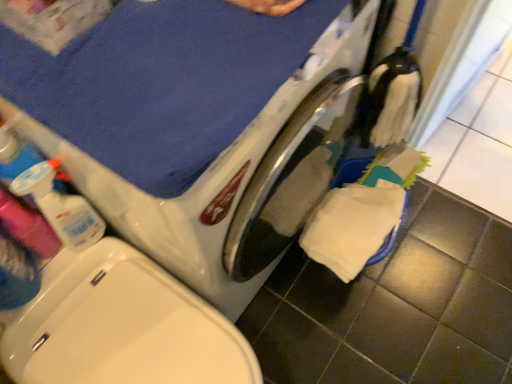
Where is `polished stainless steel washing machine at center`? polished stainless steel washing machine at center is located at coordinates (197, 126).

Measure the distance between polished stainless steel washing machine at center and camera.

polished stainless steel washing machine at center is 20.13 inches away from camera.

This screenshot has width=512, height=384. What do you see at coordinates (197, 126) in the screenshot?
I see `polished stainless steel washing machine at center` at bounding box center [197, 126].

Image resolution: width=512 pixels, height=384 pixels. What do you see at coordinates (60, 207) in the screenshot?
I see `translucent plastic spray bottle at left` at bounding box center [60, 207].

Identify the location of translucent plastic spray bottle at left. The height and width of the screenshot is (384, 512). (60, 207).

Locate an element on the screen. The width and height of the screenshot is (512, 384). polished stainless steel washing machine at center is located at coordinates (197, 126).

Is translucent plastic spray bottle at left to the left of polished stainless steel washing machine at center from the viewer's perspective?

Yes.

Between translucent plastic spray bottle at left and polished stainless steel washing machine at center, which one is positioned behind?

translucent plastic spray bottle at left is more distant.

Does point (59, 215) come closer to viewer compared to point (274, 255)?

Yes.

From the picture: From the image's perspective, between translucent plastic spray bottle at left and polished stainless steel washing machine at center, which one is located above?

polished stainless steel washing machine at center.

From a real-world perspective, is translucent plastic spray bottle at left on top of polished stainless steel washing machine at center?

Yes, from a real-world perspective, translucent plastic spray bottle at left is on top of polished stainless steel washing machine at center.

Which of these two, translucent plastic spray bottle at left or polished stainless steel washing machine at center, is thinner?

With smaller width is translucent plastic spray bottle at left.

Considering the sizes of objects translucent plastic spray bottle at left and polished stainless steel washing machine at center in the image provided, who is shorter, translucent plastic spray bottle at left or polished stainless steel washing machine at center?

translucent plastic spray bottle at left is shorter.

Based on the photo, based on their sizes in the image, would you say translucent plastic spray bottle at left is bigger or smaller than polished stainless steel washing machine at center?

Considering their sizes, translucent plastic spray bottle at left takes up less space than polished stainless steel washing machine at center.

Is polished stainless steel washing machine at center completely or partially inside translucent plastic spray bottle at left?

No.

Is translucent plastic spray bottle at left far away from polished stainless steel washing machine at center?

That's not correct — translucent plastic spray bottle at left is a little close to polished stainless steel washing machine at center.

Is polished stainless steel washing machine at center at the back of translucent plastic spray bottle at left?

translucent plastic spray bottle at left is not turned away from polished stainless steel washing machine at center.

Where is `washing machine in front of the translucent plastic spray bottle at left`? This screenshot has height=384, width=512. washing machine in front of the translucent plastic spray bottle at left is located at coordinates 197,126.

In the scene shown: Can you confirm if polished stainless steel washing machine at center is positioned to the left of translucent plastic spray bottle at left?

In fact, polished stainless steel washing machine at center is to the right of translucent plastic spray bottle at left.

Which object is closer to the camera, polished stainless steel washing machine at center or translucent plastic spray bottle at left?

polished stainless steel washing machine at center is in front.

Is point (98, 78) closer to viewer compared to point (37, 180)?

Yes, it is.

From the image's perspective, is polished stainless steel washing machine at center on translucent plastic spray bottle at left?

Yes, from the image's perspective, polished stainless steel washing machine at center is on top of translucent plastic spray bottle at left.

From a real-world perspective, is polished stainless steel washing machine at center above or below translucent plastic spray bottle at left?

From a real-world perspective, polished stainless steel washing machine at center is physically below translucent plastic spray bottle at left.

Considering the sizes of objects polished stainless steel washing machine at center and translucent plastic spray bottle at left in the image provided, who is thinner, polished stainless steel washing machine at center or translucent plastic spray bottle at left?

translucent plastic spray bottle at left is thinner.

Considering the sizes of polished stainless steel washing machine at center and translucent plastic spray bottle at left in the image, is polished stainless steel washing machine at center taller or shorter than translucent plastic spray bottle at left?

Clearly, polished stainless steel washing machine at center is taller compared to translucent plastic spray bottle at left.

Is polished stainless steel washing machine at center smaller than translucent plastic spray bottle at left?

No.

Can we say polished stainless steel washing machine at center lies outside translucent plastic spray bottle at left?

Indeed, polished stainless steel washing machine at center is completely outside translucent plastic spray bottle at left.

Is polished stainless steel washing machine at center positioned far away from translucent plastic spray bottle at left?

That's not correct — polished stainless steel washing machine at center is a little close to translucent plastic spray bottle at left.

Is translucent plastic spray bottle at left at the back of polished stainless steel washing machine at center?

No.

How different are the orientations of polished stainless steel washing machine at center and translucent plastic spray bottle at left in degrees?

The angular difference between polished stainless steel washing machine at center and translucent plastic spray bottle at left is 0.274 degrees.

Measure the distance from polished stainless steel washing machine at center to translucent plastic spray bottle at left.

They are 13.05 inches apart.

Find the location of `washing machine in front of the translucent plastic spray bottle at left`. washing machine in front of the translucent plastic spray bottle at left is located at coordinates (197, 126).

At what (x,y) coordinates should I click in order to perform the action: click on cleaning product above the polished stainless steel washing machine at center (from a real-world perspective). Please return your answer as a coordinate pair (x, y). The width and height of the screenshot is (512, 384). Looking at the image, I should click on (60, 207).

At what (x,y) coordinates should I click in order to perform the action: click on cleaning product behind the polished stainless steel washing machine at center. Please return your answer as a coordinate pair (x, y). The image size is (512, 384). Looking at the image, I should click on (60, 207).